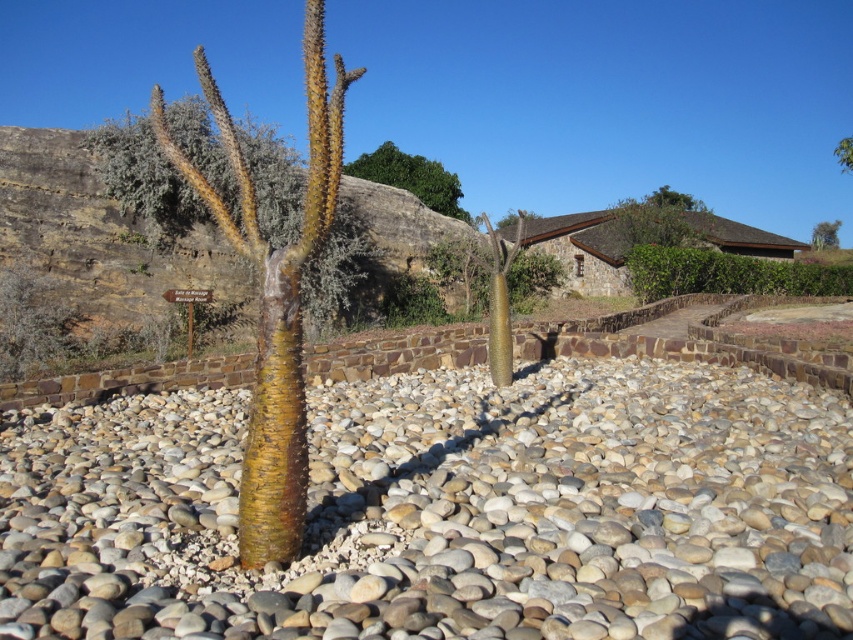
Who is more forward, (x=91, y=144) or (x=846, y=163)?

Point (x=91, y=144) is in front.

Can you confirm if brown rough cactus at upper left is wider than green leafy tree at upper right?

Correct, the width of brown rough cactus at upper left exceeds that of green leafy tree at upper right.

Where is `brown rough cactus at upper left`? The image size is (853, 640). brown rough cactus at upper left is located at coordinates (144, 177).

Identify the location of brown rough cactus at upper left. The width and height of the screenshot is (853, 640). (144, 177).

Is smooth pebbles at center behind green leafy tree at upper right?

That is False.

Is smooth pebbles at center above green leafy tree at upper right?

Actually, smooth pebbles at center is below green leafy tree at upper right.

Is point (476, 492) positioned after point (842, 163)?

No, (476, 492) is closer to viewer.

Identify the location of smooth pebbles at center. This screenshot has height=640, width=853. (445, 509).

Is brown textured cactus at center to the left of green leafy tree at upper right from the viewer's perspective?

Yes, brown textured cactus at center is to the left of green leafy tree at upper right.

You are a GUI agent. You are given a task and a screenshot of the screen. Output one action in this format:
    pyautogui.click(x=<x>, y=<y>)
    Task: Click on the brown textured cactus at center
    Image resolution: width=853 pixels, height=640 pixels.
    Given the screenshot: What is the action you would take?
    pyautogui.click(x=274, y=296)